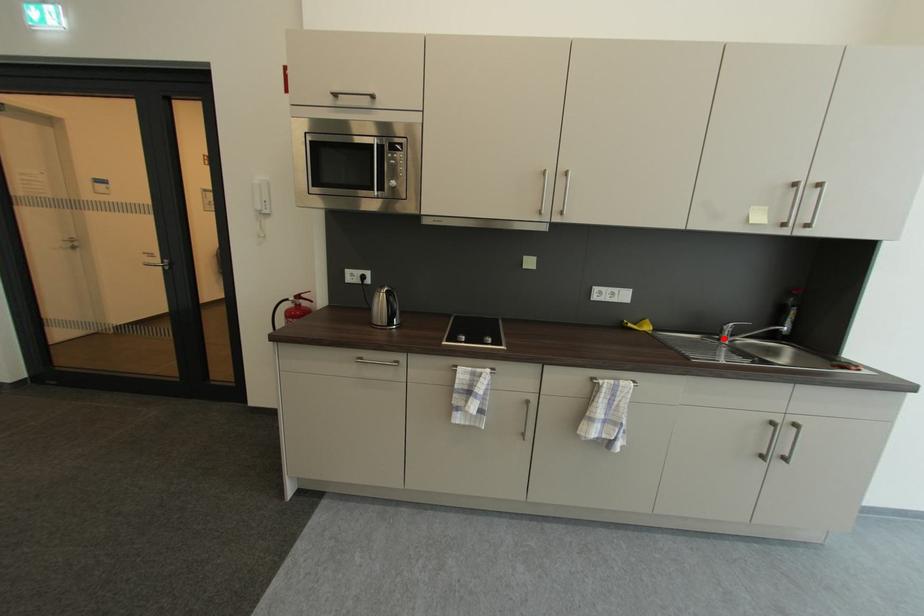
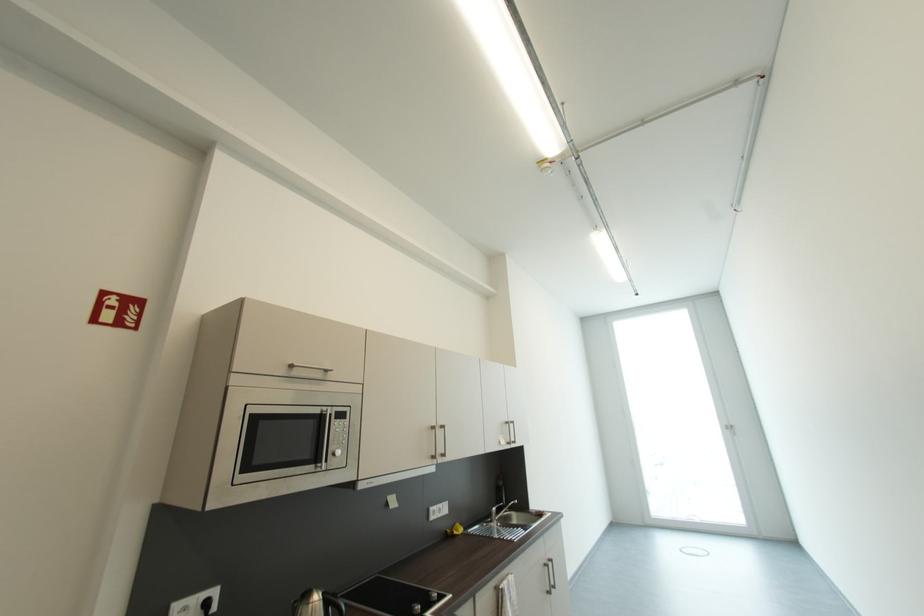
In the second image, find the point that corresponds to the highlighted location in the first image.

(495, 522)